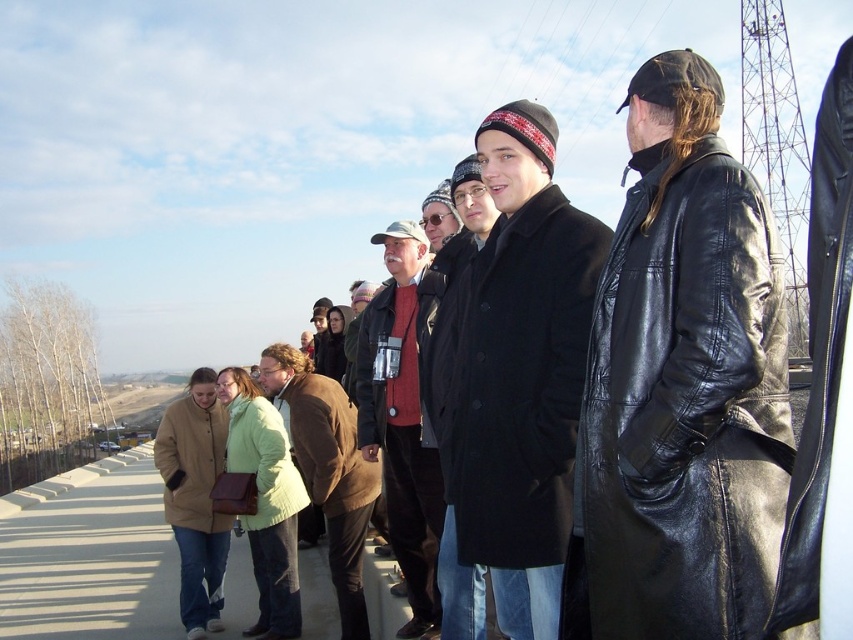
Question: Which object is positioned closest to the matte black coat at center?

Choices:
 (A) beige wool coat at lower left
 (B) black leather coat at center
 (C) matte red sweater at center

Answer: (B)

Question: Which point is farther from the camera taking this photo?

Choices:
 (A) (479, 225)
 (B) (210, 577)
 (C) (289, 401)
 (D) (392, 294)

Answer: (D)

Question: Which of the following is the closest to the observer?

Choices:
 (A) (337, 413)
 (B) (271, 456)
 (C) (467, 566)

Answer: (C)

Question: Can you confirm if brown leather jacket at lower left is positioned to the right of light green fabric jacket at center?

Choices:
 (A) no
 (B) yes

Answer: (B)

Question: Can you confirm if matte black coat at center is wider than matte red sweater at center?

Choices:
 (A) no
 (B) yes

Answer: (B)

Question: Can you confirm if matte black coat at center is positioned below light green fabric jacket at center?

Choices:
 (A) yes
 (B) no

Answer: (B)